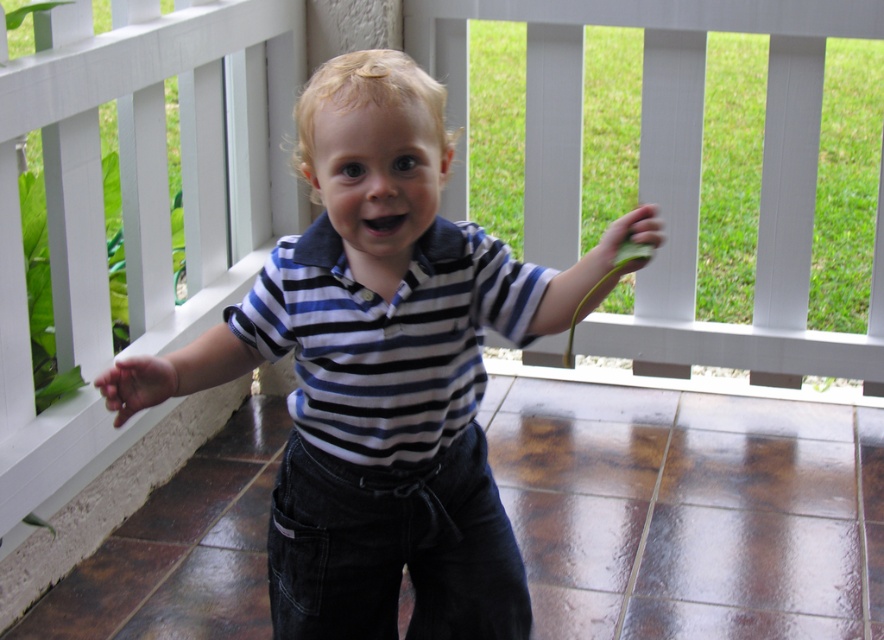
Is striped cotton shirt at center below blue striped shirt at center?

Yes.

What do you see at coordinates (387, 371) in the screenshot?
I see `striped cotton shirt at center` at bounding box center [387, 371].

Locate an element on the screen. Image resolution: width=884 pixels, height=640 pixels. striped cotton shirt at center is located at coordinates (387, 371).

Who is lower down, blue striped shirt at center or green leafy hand at right?

blue striped shirt at center is lower down.

You are a GUI agent. You are given a task and a screenshot of the screen. Output one action in this format:
    pyautogui.click(x=<x>, y=<y>)
    Task: Click on the blue striped shirt at center
    This screenshot has width=884, height=640.
    Given the screenshot: What is the action you would take?
    pyautogui.click(x=387, y=337)

Does striped cotton shirt at center have a lesser height compared to matte skin hand at lower left?

Incorrect, striped cotton shirt at center's height does not fall short of matte skin hand at lower left's.

Who is shorter, striped cotton shirt at center or matte skin hand at lower left?

matte skin hand at lower left

Measure the distance between striped cotton shirt at center and camera.

striped cotton shirt at center and camera are 1.56 meters apart.

The image size is (884, 640). Find the location of `striped cotton shirt at center`. striped cotton shirt at center is located at coordinates (387, 371).